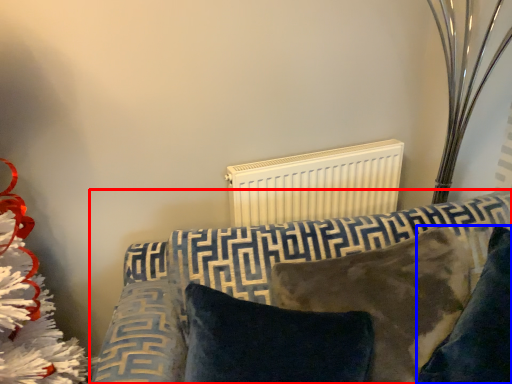
Question: Which of the following is the closest to the observer, furniture (highlighted by a red box) or pillow (highlighted by a blue box)?

Choices:
 (A) furniture
 (B) pillow

Answer: (A)